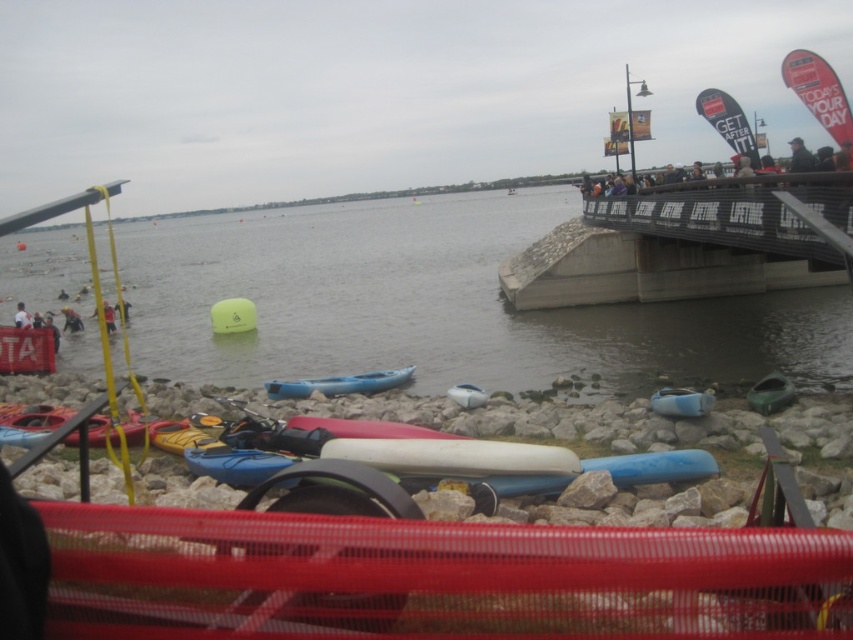
Between clear water at lower left and red mesh netting at lower center, which one is positioned higher?

Positioned higher is clear water at lower left.

Does clear water at lower left have a lesser width compared to red mesh netting at lower center?

Incorrect, clear water at lower left's width is not less than red mesh netting at lower center's.

What do you see at coordinates (439, 304) in the screenshot?
I see `clear water at lower left` at bounding box center [439, 304].

Identify the location of clear water at lower left. The height and width of the screenshot is (640, 853). (439, 304).

Between blue rubber boat at center and green matte kayak at lower right, which one has more height?

green matte kayak at lower right is taller.

Is blue rubber boat at center to the left of green matte kayak at lower right from the viewer's perspective?

Indeed, blue rubber boat at center is positioned on the left side of green matte kayak at lower right.

Is point (671, 416) positioned before point (770, 388)?

Yes, point (671, 416) is in front of point (770, 388).

At what (x,y) coordinates should I click in order to perform the action: click on blue rubber boat at center. Please return your answer as a coordinate pair (x, y). Image resolution: width=853 pixels, height=640 pixels. Looking at the image, I should click on (682, 403).

Measure the distance between point (476, 400) and camera.

They are 52.80 feet apart.

Is white matte kayak at center further to the viewer compared to white fabric person at lower left?

That is False.

Which is in front, point (477, 406) or point (15, 316)?

Point (477, 406)

Identify the location of white matte kayak at center. (467, 396).